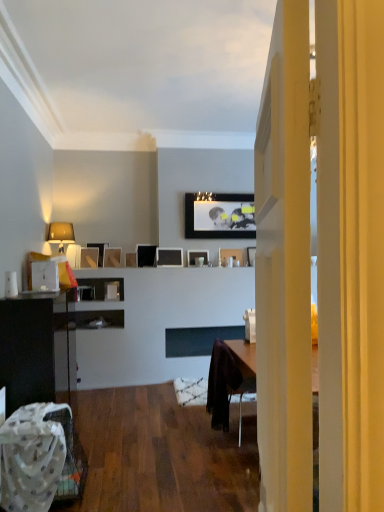
Locate an element on the screen. The height and width of the screenshot is (512, 384). matte white picture frame at center, which is the 9th picture frame in left-to-right order is located at coordinates (230, 256).

In the scene shown: How much space does matte black picture frame at upper center, which is the 7th picture frame in left-to-right order, occupy horizontally?

It is 3.56 inches.

The height and width of the screenshot is (512, 384). Find the location of `matte black picture frame at upper center, positioned as the 5th picture frame in right-to-left order`. matte black picture frame at upper center, positioned as the 5th picture frame in right-to-left order is located at coordinates (169, 257).

Which is more to the left, matte wooden picture frame at upper center, which ranks as the 10th picture frame in right-to-left order, or matte black picture frame at upper center, which appears as the third picture frame when viewed from the left?

matte wooden picture frame at upper center, which ranks as the 10th picture frame in right-to-left order.

Is matte wooden picture frame at upper center, which ranks as the 10th picture frame in right-to-left order, oriented away from matte black picture frame at upper center, which appears as the third picture frame when viewed from the left?

That's not correct — matte wooden picture frame at upper center, which ranks as the 10th picture frame in right-to-left order, is not looking away from matte black picture frame at upper center, which appears as the third picture frame when viewed from the left.

In the scene shown: In the image, is matte wooden picture frame at upper center, which ranks as the 10th picture frame in right-to-left order, positioned in front of or behind matte black picture frame at upper center, which appears as the third picture frame when viewed from the left?

Clearly, matte wooden picture frame at upper center, which ranks as the 10th picture frame in right-to-left order, is in front of matte black picture frame at upper center, which appears as the third picture frame when viewed from the left.

Is matte black picture frame at upper center, positioned as the 5th picture frame in right-to-left order, thinner than matte black picture frame at upper center, the first picture frame from the right?

No.

Can you confirm if matte black picture frame at upper center, positioned as the 5th picture frame in right-to-left order, is positioned to the right of matte black picture frame at upper center, marked as the 10th picture frame in a left-to-right arrangement?

No, matte black picture frame at upper center, positioned as the 5th picture frame in right-to-left order, is not to the right of matte black picture frame at upper center, marked as the 10th picture frame in a left-to-right arrangement.

Which is further, (159, 263) or (254, 260)?

Positioned behind is point (159, 263).

Would you say matte black picture frame at upper center, the 6th picture frame positioned from the left, is inside or outside matte black picture frame at upper center, marked as the 10th picture frame in a left-to-right arrangement?

The correct answer is: outside.

Between matte black picture frame at upper center, which appears as the third picture frame when viewed from the left, and wooden picture frame at center, positioned as the fourth picture frame in left-to-right order, which one has more height?

With more height is matte black picture frame at upper center, which appears as the third picture frame when viewed from the left.

From a real-world perspective, which object stands above the other?

matte black picture frame at upper center, which is the 8th picture frame from right to left, is physically above.

Considering the points (108, 261) and (130, 261), which point is behind, point (108, 261) or point (130, 261)?

The point (130, 261) is more distant.

Consider the image. Are matte black picture frame at upper center, which is the 8th picture frame from right to left, and wooden picture frame at center, acting as the seventh picture frame starting from the right, located far from each other?

No, matte black picture frame at upper center, which is the 8th picture frame from right to left, is not far away from wooden picture frame at center, acting as the seventh picture frame starting from the right.

Could you tell me if matte black picture frame at upper center, which appears as the third picture frame when viewed from the left, is facing matte black picture frame at upper center, which ranks as the third picture frame in right-to-left order?

No, matte black picture frame at upper center, which appears as the third picture frame when viewed from the left, is not oriented towards matte black picture frame at upper center, which ranks as the third picture frame in right-to-left order.

Considering the relative positions of matte black picture frame at upper center, which is the 8th picture frame from right to left, and matte black picture frame at upper center, which ranks as the third picture frame in right-to-left order, in the image provided, is matte black picture frame at upper center, which is the 8th picture frame from right to left, to the left of matte black picture frame at upper center, which ranks as the third picture frame in right-to-left order, from the viewer's perspective?

Indeed, matte black picture frame at upper center, which is the 8th picture frame from right to left, is positioned on the left side of matte black picture frame at upper center, which ranks as the third picture frame in right-to-left order.

Considering the relative sizes of matte black picture frame at upper center, which is the 8th picture frame from right to left, and matte black picture frame at upper center, which ranks as the third picture frame in right-to-left order, in the image provided, is matte black picture frame at upper center, which is the 8th picture frame from right to left, shorter than matte black picture frame at upper center, which ranks as the third picture frame in right-to-left order,?

Yes.

In the image, is matte black picture frame at upper center, which is the 8th picture frame from right to left, positioned in front of or behind matte black picture frame at upper center, which ranks as the third picture frame in right-to-left order?

matte black picture frame at upper center, which is the 8th picture frame from right to left, is in front of matte black picture frame at upper center, which ranks as the third picture frame in right-to-left order.

From a real-world perspective, which object rests below the other?

matte black cabinet at left, from a real-world perspective.

Are matte black picture frame at upper center, the fifth picture frame viewed from the left, and matte black cabinet at left located far from each other?

Absolutely, matte black picture frame at upper center, the fifth picture frame viewed from the left, is distant from matte black cabinet at left.

Considering the positions of points (142, 261) and (43, 356), is point (142, 261) closer to camera compared to point (43, 356)?

No, (142, 261) is behind (43, 356).

Could you tell me if matte black picture frame at upper center, the fifth picture frame viewed from the left, is facing matte black cabinet at left?

No, matte black picture frame at upper center, the fifth picture frame viewed from the left, is not turned towards matte black cabinet at left.

Considering the sizes of objects velvet dark brown swivel chair at center and matte white picture frame at center, which is the 9th picture frame in left-to-right order, in the image provided, who is wider, velvet dark brown swivel chair at center or matte white picture frame at center, which is the 9th picture frame in left-to-right order,?

Wider between the two is velvet dark brown swivel chair at center.

Which is in front, velvet dark brown swivel chair at center or matte white picture frame at center, which is the 9th picture frame in left-to-right order?

velvet dark brown swivel chair at center is in front.

Is velvet dark brown swivel chair at center positioned far away from matte white picture frame at center, which ranks as the 2th picture frame in right-to-left order?

That's right, there is a large distance between velvet dark brown swivel chair at center and matte white picture frame at center, which ranks as the 2th picture frame in right-to-left order.

From the velvet dark brown swivel chair at center, count 9th picture frames backward and point to it. Please provide its 2D coordinates.

[(230, 256)]

Which is correct: wooden picture frame at center, acting as the seventh picture frame starting from the right, is inside matte wooden picture frame at upper center, which ranks as the 10th picture frame in right-to-left order, or outside of it?

wooden picture frame at center, acting as the seventh picture frame starting from the right, cannot be found inside matte wooden picture frame at upper center, which ranks as the 10th picture frame in right-to-left order.

From the image's perspective, is wooden picture frame at center, acting as the seventh picture frame starting from the right, positioned above or below matte wooden picture frame at upper center, which ranks as the 10th picture frame in right-to-left order?

wooden picture frame at center, acting as the seventh picture frame starting from the right, is situated lower than matte wooden picture frame at upper center, which ranks as the 10th picture frame in right-to-left order, in the image.

Measure the distance from wooden picture frame at center, acting as the seventh picture frame starting from the right, to matte wooden picture frame at upper center, which ranks as the 10th picture frame in right-to-left order.

wooden picture frame at center, acting as the seventh picture frame starting from the right, and matte wooden picture frame at upper center, which ranks as the 10th picture frame in right-to-left order, are 48.35 centimeters apart.

Is wooden picture frame at center, acting as the seventh picture frame starting from the right, positioned with its back to matte wooden picture frame at upper center, which is the first picture frame in left-to-right order?

No, wooden picture frame at center, acting as the seventh picture frame starting from the right, is not facing away from matte wooden picture frame at upper center, which is the first picture frame in left-to-right order.

Where is `picture frame that appears in front of the matte black picture frame at upper center, which is the 8th picture frame from right to left`? This screenshot has height=512, width=384. picture frame that appears in front of the matte black picture frame at upper center, which is the 8th picture frame from right to left is located at coordinates (89, 257).

Find the location of `picture frame that is the 4th one when counting leftward from the matte black picture frame at upper center, the first picture frame from the right`. picture frame that is the 4th one when counting leftward from the matte black picture frame at upper center, the first picture frame from the right is located at coordinates (169, 257).

Looking at the image, which one is located closer to wooden picture frame at center, acting as the seventh picture frame starting from the right, matte white picture frame at center, which ranks as the 2th picture frame in right-to-left order, or matte black cabinet at left?

The object closer to wooden picture frame at center, acting as the seventh picture frame starting from the right, is matte black cabinet at left.

Looking at the image, which one is located closer to matte black picture frame at upper center, which appears as the third picture frame when viewed from the left, matte wooden picture frame at upper center, which ranks as the 10th picture frame in right-to-left order, or white fabric chair at lower left?

matte wooden picture frame at upper center, which ranks as the 10th picture frame in right-to-left order, is positioned closer to the anchor matte black picture frame at upper center, which appears as the third picture frame when viewed from the left.

Looking at the image, which one is located closer to wooden picture frame at center, acting as the seventh picture frame starting from the right, matte black picture frame at upper center, which is the 8th picture frame from right to left, or matte black picture frame at upper center, the eighth picture frame from the left?

matte black picture frame at upper center, which is the 8th picture frame from right to left, lies closer to wooden picture frame at center, acting as the seventh picture frame starting from the right, than the other object.

Estimate the real-world distances between objects in this image. Which object is further from velvet dark brown swivel chair at center, matte black picture frame at upper center, positioned as the 5th picture frame in right-to-left order, or matte black picture frame at center, arranged as the 9th picture frame when viewed from the right?

Among the two, matte black picture frame at center, arranged as the 9th picture frame when viewed from the right, is located further to velvet dark brown swivel chair at center.

Estimate the real-world distances between objects in this image. Which object is closer to matte black picture frame at upper center, the 6th picture frame positioned from the left, matte black cabinet at left or matte beige lampshade at left?

The object closer to matte black picture frame at upper center, the 6th picture frame positioned from the left, is matte beige lampshade at left.

Considering their positions, is matte black picture frame at upper center, which appears as the 6th picture frame when viewed from the right, positioned closer to matte black picture frame at upper center, which is the 7th picture frame in left-to-right order, than matte black picture frame at center, marked as the second picture frame in a left-to-right arrangement?

matte black picture frame at upper center, which appears as the 6th picture frame when viewed from the right, lies closer to matte black picture frame at upper center, which is the 7th picture frame in left-to-right order, than the other object.

Considering their positions, is matte black picture frame at upper center, the fifth picture frame viewed from the left, positioned closer to matte black picture frame at upper center, the eighth picture frame from the left, than matte beige lampshade at left?

matte black picture frame at upper center, the fifth picture frame viewed from the left, lies closer to matte black picture frame at upper center, the eighth picture frame from the left, than the other object.

When comparing their distances from matte black picture frame at upper center, which is the 7th picture frame in left-to-right order, does matte beige lampshade at left or matte black picture frame at upper center, which ranks as the third picture frame in right-to-left order, seem further?

Among the two, matte beige lampshade at left is located further to matte black picture frame at upper center, which is the 7th picture frame in left-to-right order.

At what (x,y) coordinates should I click in order to perform the action: click on swivel chair between matte black cabinet at left and matte black picture frame at upper center, which appears as the third picture frame when viewed from the left, along the z-axis. Please return your answer as a coordinate pair (x, y). Image resolution: width=384 pixels, height=512 pixels. Looking at the image, I should click on (226, 384).

At what (x,y) coordinates should I click in order to perform the action: click on swivel chair between matte wooden picture frame at upper center, which is the first picture frame in left-to-right order, and matte black picture frame at upper center, marked as the 10th picture frame in a left-to-right arrangement. Please return your answer as a coordinate pair (x, y). Image resolution: width=384 pixels, height=512 pixels. Looking at the image, I should click on click(x=226, y=384).

You are a GUI agent. You are given a task and a screenshot of the screen. Output one action in this format:
    pyautogui.click(x=<x>, y=<y>)
    Task: Click on the swivel chair positioned between matte black cabinet at left and matte wooden picture frame at upper center, which ranks as the 10th picture frame in right-to-left order, from near to far
    The image size is (384, 512).
    Given the screenshot: What is the action you would take?
    pyautogui.click(x=226, y=384)

I want to click on swivel chair between white fabric chair at lower left and matte black picture frame at upper center, which ranks as the third picture frame in right-to-left order, from front to back, so click(x=226, y=384).